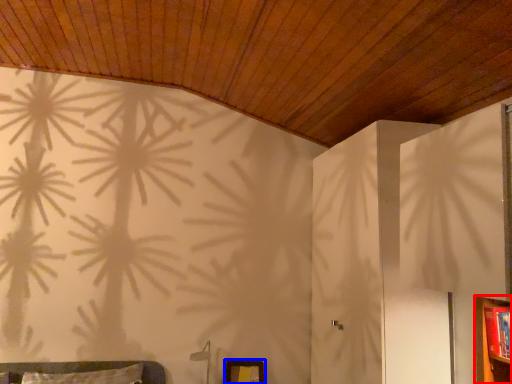
Question: Which point is further to the camera, dresser (highlighted by a red box) or picture frame (highlighted by a blue box)?

Choices:
 (A) dresser
 (B) picture frame

Answer: (B)